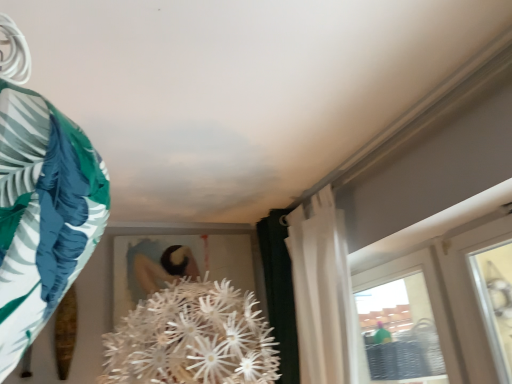
Question: From the image's perspective, is white sheer curtain at upper right positioned above or below green fabric at left?

Choices:
 (A) above
 (B) below

Answer: (B)

Question: Based on their sizes in the image, would you say white sheer curtain at upper right is bigger or smaller than green fabric at left?

Choices:
 (A) big
 (B) small

Answer: (A)

Question: Looking at their shapes, would you say white sheer curtain at upper right is wider or thinner than green fabric at left?

Choices:
 (A) wide
 (B) thin

Answer: (A)

Question: Considering the positions of green fabric at left and white sheer curtain at upper right in the image, is green fabric at left wider or thinner than white sheer curtain at upper right?

Choices:
 (A) wide
 (B) thin

Answer: (B)

Question: From a real-world perspective, is green fabric at left physically located above or below white sheer curtain at upper right?

Choices:
 (A) below
 (B) above

Answer: (B)

Question: From their relative heights in the image, would you say green fabric at left is taller or shorter than white sheer curtain at upper right?

Choices:
 (A) tall
 (B) short

Answer: (B)

Question: Considering their positions, is green fabric at left located in front of or behind white sheer curtain at upper right?

Choices:
 (A) behind
 (B) front

Answer: (B)